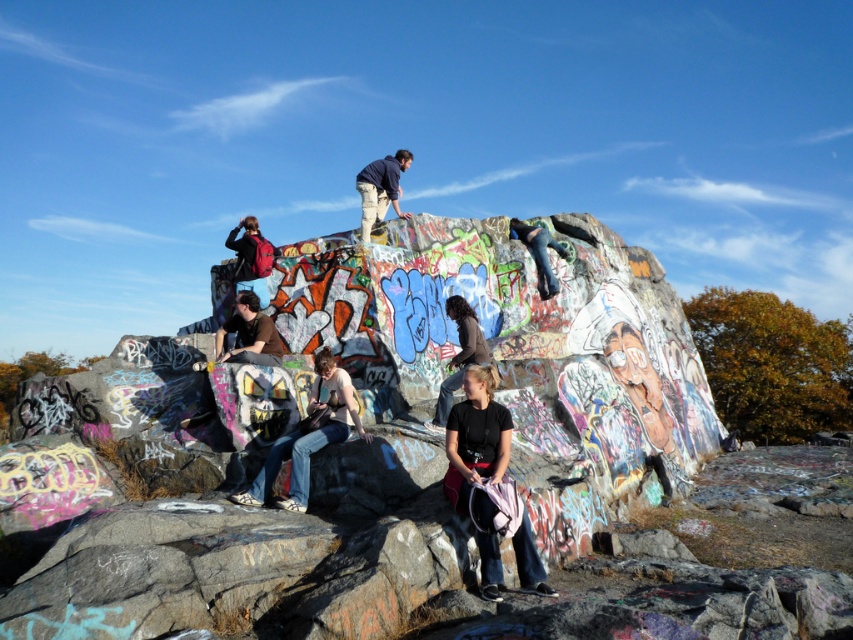
Can you confirm if denim jeans at center is shorter than brown matte shirt at center?

No.

Can you confirm if denim jeans at center is taller than brown matte shirt at center?

Correct, denim jeans at center is much taller as brown matte shirt at center.

Is point (325, 355) behind point (242, 298)?

No, (325, 355) is closer to viewer.

Identify the location of denim jeans at center. (308, 436).

Between brown matte shirt at center and dark blue shirt at upper center, which one appears on the left side from the viewer's perspective?

Positioned to the left is brown matte shirt at center.

Find the location of a particular element. This screenshot has width=853, height=640. brown matte shirt at center is located at coordinates (248, 333).

Who is positioned more to the left, dark brown leather jacket at center or blue jeans at upper center?

From the viewer's perspective, dark brown leather jacket at center appears more on the left side.

You are a GUI agent. You are given a task and a screenshot of the screen. Output one action in this format:
    pyautogui.click(x=<x>, y=<y>)
    Task: Click on the dark brown leather jacket at center
    
    Given the screenshot: What is the action you would take?
    pyautogui.click(x=460, y=353)